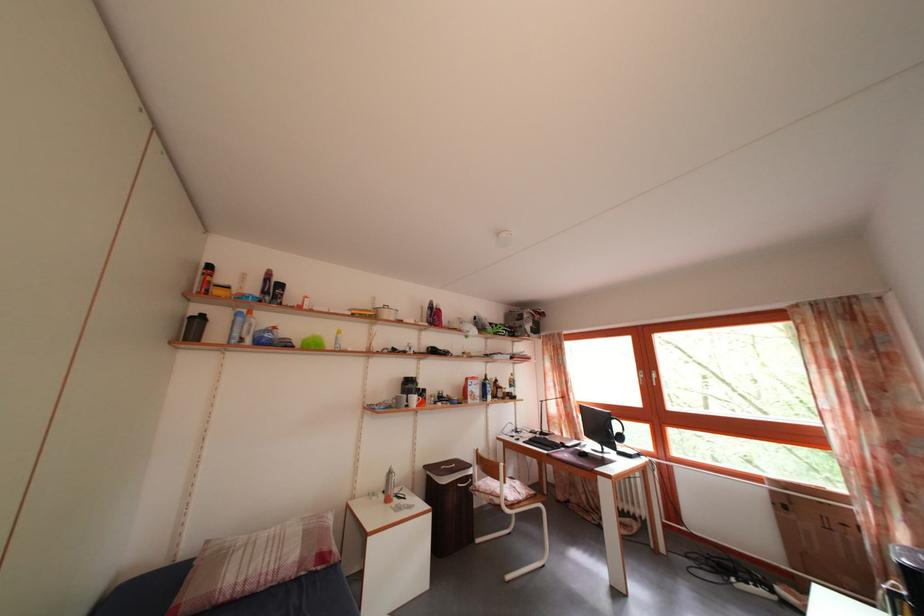
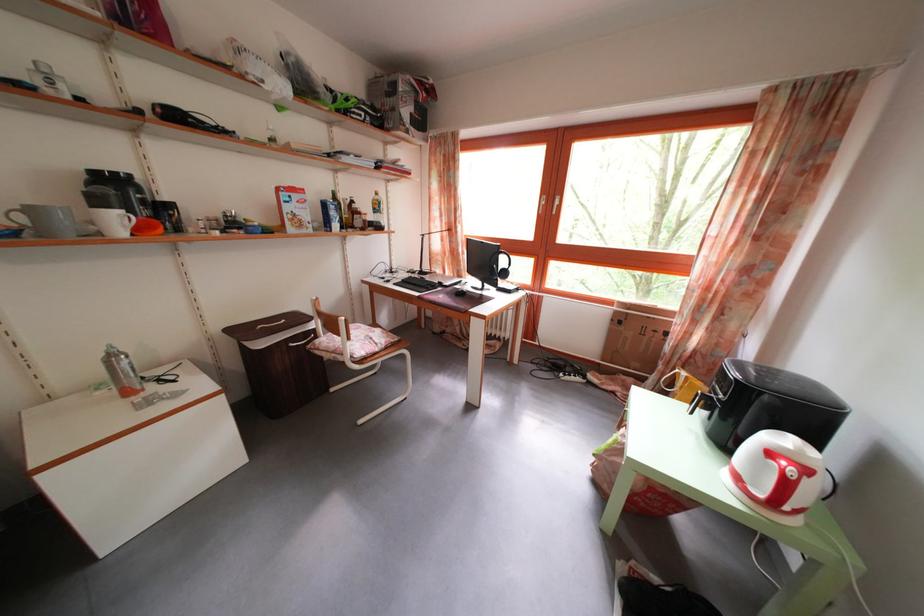
In the second image, find the point that corresponds to point (606, 431) in the first image.

(492, 265)